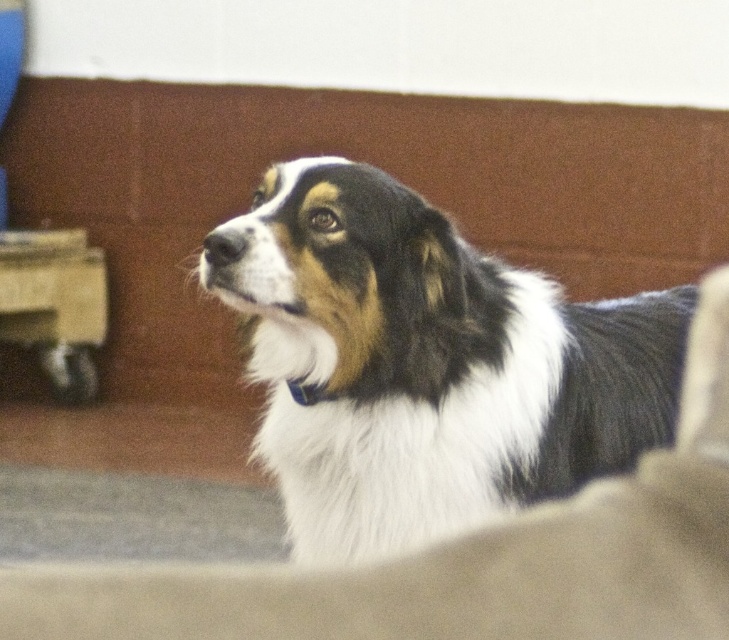
Looking at this image, between white-furred dog at center and beige fabric dog bed at center, which one is positioned higher?

white-furred dog at center is higher up.

Between white-furred dog at center and beige fabric dog bed at center, which one has more height?

Standing taller between the two is white-furred dog at center.

What do you see at coordinates (424, 364) in the screenshot?
I see `white-furred dog at center` at bounding box center [424, 364].

Where is `white-furred dog at center`? The height and width of the screenshot is (640, 729). white-furred dog at center is located at coordinates (424, 364).